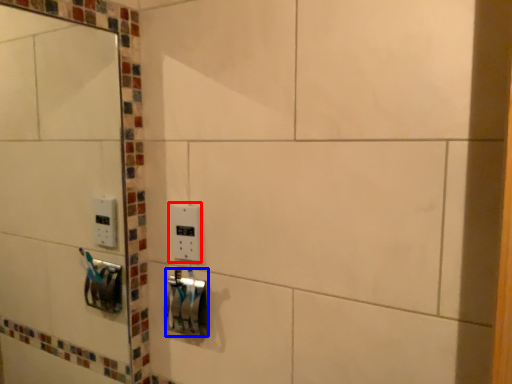
Question: Which object is further to the camera taking this photo, light switch (highlighted by a red box) or lock (highlighted by a blue box)?

Choices:
 (A) light switch
 (B) lock

Answer: (A)